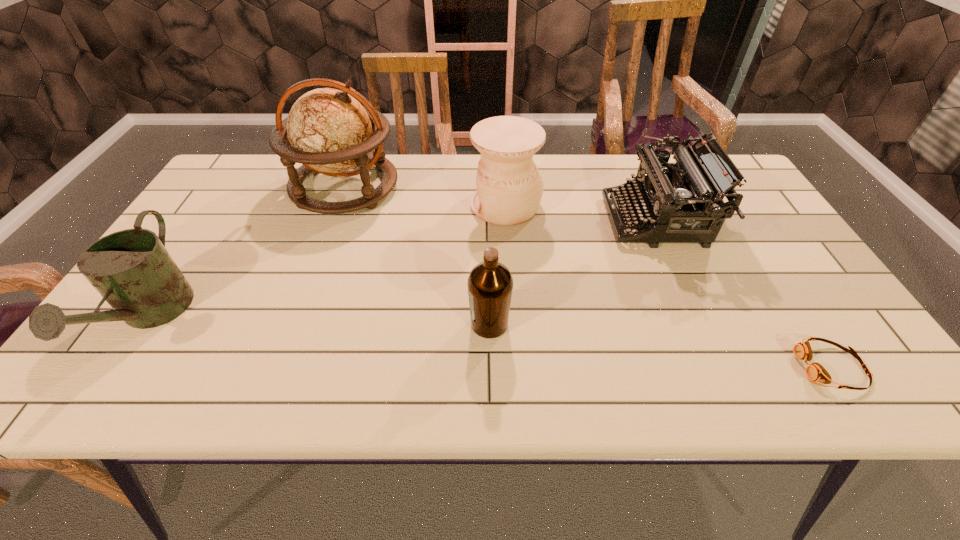
Image resolution: width=960 pixels, height=540 pixels. In order to click on free space located 0.370m at the open side of the pottery in this screenshot , I will do `click(339, 205)`.

At what (x,y) coordinates should I click in order to perform the action: click on vacant space situated 0.150m at the open side of the pottery. Please return your answer as a coordinate pair (x, y). The image size is (960, 540). Looking at the image, I should click on 417,205.

Locate an element on the screen. The height and width of the screenshot is (540, 960). free space located on the keyboard of the fifth object from left to right is located at coordinates (504, 220).

Locate an element on the screen. The width and height of the screenshot is (960, 540). free space located on the keyboard of the fifth object from left to right is located at coordinates (512, 220).

Identify the location of vacant space situated 0.050m on the keyboard of the fifth object from left to right. The width and height of the screenshot is (960, 540). (589, 220).

Identify the location of vacant point located on the label of the olive oil. This screenshot has height=540, width=960. (395, 324).

In order to click on vacant point located on the label of the olive oil in this screenshot , I will do `click(436, 324)`.

I want to click on free space located on the label of the olive oil, so click(x=343, y=324).

Where is `vacant region located with the lenses facing forward on the rightmost object`? vacant region located with the lenses facing forward on the rightmost object is located at coordinates (693, 367).

At what (x,y) coordinates should I click in order to perform the action: click on vacant space located 0.370m with the lenses facing forward on the rightmost object. Please return your answer as a coordinate pair (x, y). This screenshot has height=540, width=960. Looking at the image, I should click on (612, 367).